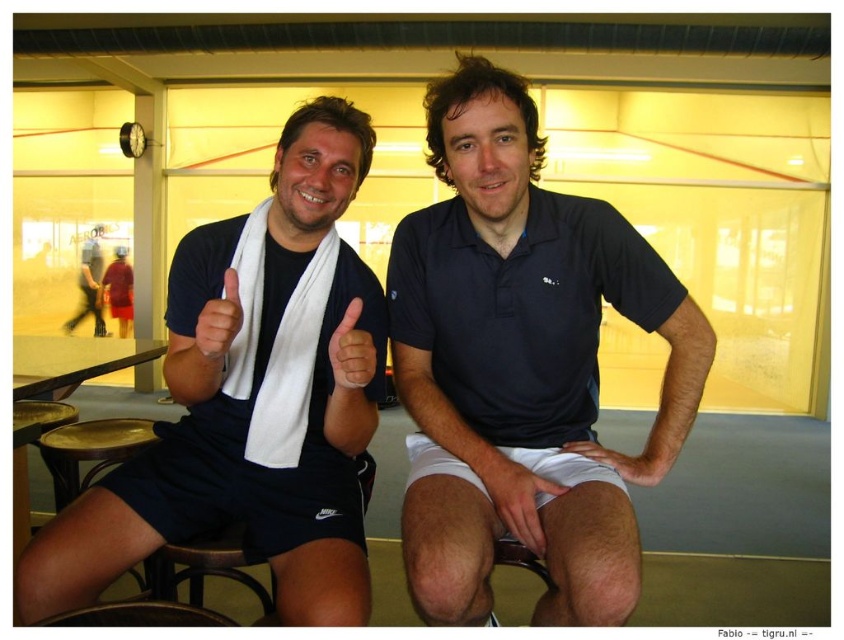
Does dark blue cotton polo shirt at center appear over dark blue shorts at center?

Incorrect, dark blue cotton polo shirt at center is not positioned above dark blue shorts at center.

Is dark blue cotton polo shirt at center taller than dark blue shorts at center?

No.

Between point (569, 204) and point (95, 266), which one is positioned behind?

Point (95, 266)

I want to click on dark blue cotton polo shirt at center, so click(522, 310).

Can you confirm if matte white hand at center is bigger than matte white towel at upper center?

No.

How far apart are matte white hand at center and matte white towel at upper center?

A distance of 7.22 inches exists between matte white hand at center and matte white towel at upper center.

Between point (356, 305) and point (219, 323), which one is positioned in front?

Positioned in front is point (219, 323).

The height and width of the screenshot is (640, 844). Find the location of `matte white hand at center`. matte white hand at center is located at coordinates (350, 355).

Does dark blue polo shirt at center have a lesser width compared to white fabric hand at center?

Incorrect, dark blue polo shirt at center's width is not less than white fabric hand at center's.

Does dark blue polo shirt at center appear on the right side of white fabric hand at center?

No, dark blue polo shirt at center is not to the right of white fabric hand at center.

Is point (493, 280) farther from camera compared to point (648, 481)?

Yes, it is behind point (648, 481).

Identify the location of dark blue polo shirt at center. (520, 288).